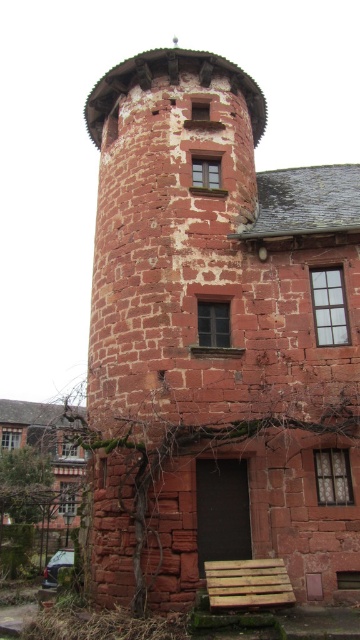
Is red stone tower at center wider than wooden pallet at lower center?

Yes.

Does red stone tower at center appear over wooden pallet at lower center?

Yes, red stone tower at center is above wooden pallet at lower center.

Which is in front, point (205, 186) or point (272, 602)?

Point (272, 602) is in front.

The image size is (360, 640). I want to click on red stone tower at center, so click(x=218, y=340).